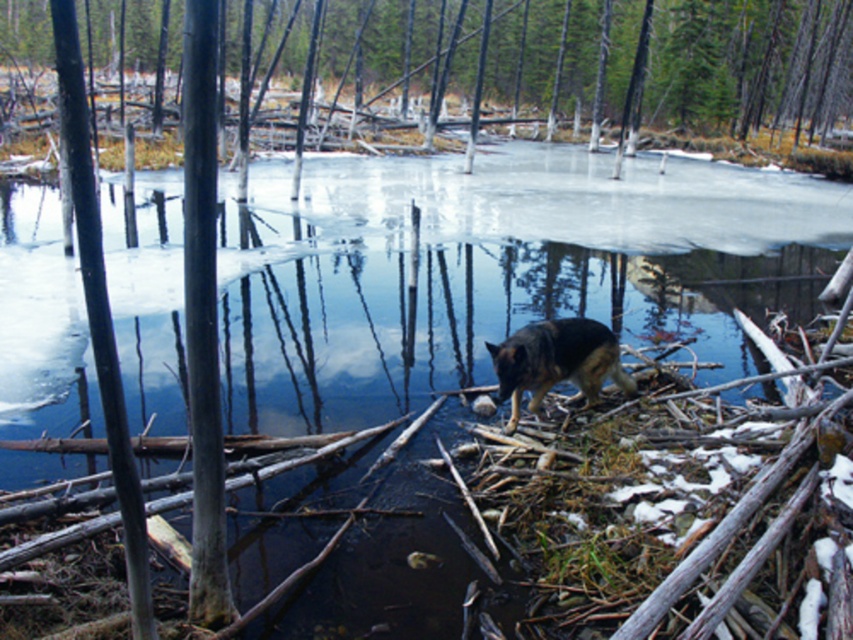
Does smooth bark tree at center appear under dark brown fur dog at center?

No, smooth bark tree at center is not below dark brown fur dog at center.

Does point (755, 104) come behind point (608, 332)?

Yes, point (755, 104) is behind point (608, 332).

Between point (756, 116) and point (525, 324), which one is positioned behind?

The point (756, 116) is behind.

Image resolution: width=853 pixels, height=640 pixels. I want to click on smooth bark tree at center, so click(682, 60).